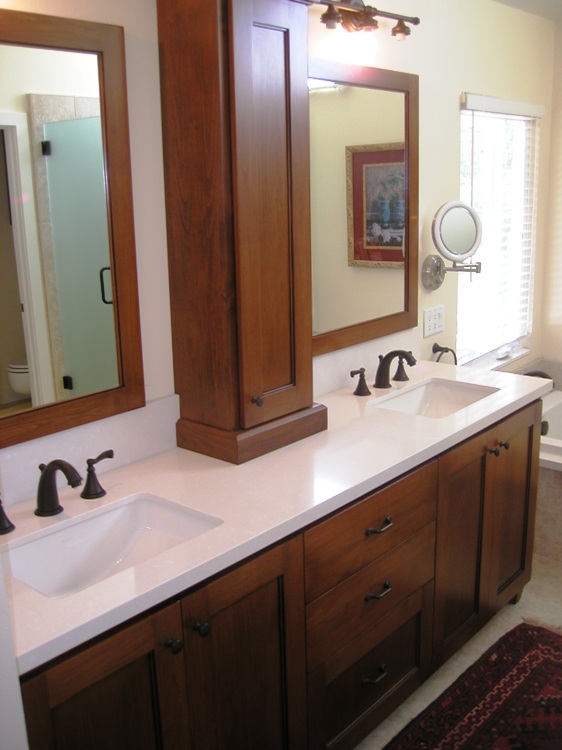
You are a GUI agent. You are given a task and a screenshot of the screen. Output one action in this format:
    pyautogui.click(x=<x>, y=<y>)
    Task: Click on the mirror
    
    Given the screenshot: What is the action you would take?
    pyautogui.click(x=85, y=361), pyautogui.click(x=347, y=297), pyautogui.click(x=451, y=226)